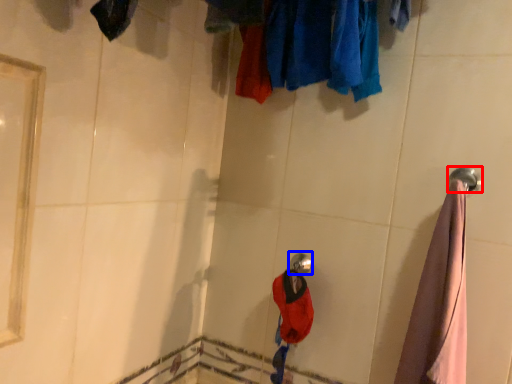
Question: Which object appears closest to the camera in this image, towel rack (highlighted by a red box) or shower (highlighted by a blue box)?

Choices:
 (A) towel rack
 (B) shower

Answer: (A)